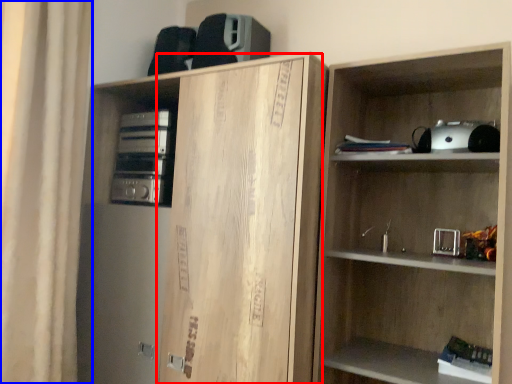
Question: Which object is closer to the camera taking this photo, cabinetry (highlighted by a red box) or curtain (highlighted by a blue box)?

Choices:
 (A) cabinetry
 (B) curtain

Answer: (A)